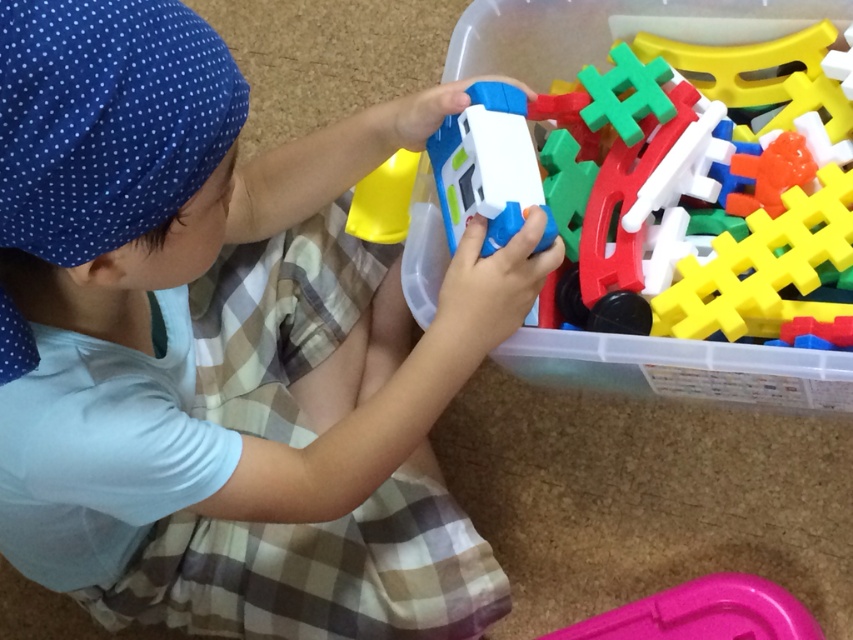
Which of these two, matte plastic toy car at center or blue plastic toy car at center, stands taller?

matte plastic toy car at center

Does matte plastic toy car at center appear on the right side of blue plastic toy car at center?

Incorrect, matte plastic toy car at center is not on the right side of blue plastic toy car at center.

The image size is (853, 640). I want to click on matte plastic toy car at center, so click(224, 348).

The height and width of the screenshot is (640, 853). Find the location of `matte plastic toy car at center`. matte plastic toy car at center is located at coordinates (224, 348).

Who is more forward, (437, 84) or (776, 621)?

Point (437, 84) is more forward.

Between matte plastic toy car at center and pink plastic tray at lower right, which one appears on the right side from the viewer's perspective?

pink plastic tray at lower right

Is point (143, 308) positioned behind point (637, 611)?

No, (143, 308) is in front of (637, 611).

Locate an element on the screen. Image resolution: width=853 pixels, height=640 pixels. matte plastic toy car at center is located at coordinates (224, 348).

Is blue plastic toy car at center positioned in front of pink plastic tray at lower right?

Result: Yes, it is.

I want to click on blue plastic toy car at center, so click(637, 147).

You are a GUI agent. You are given a task and a screenshot of the screen. Output one action in this format:
    pyautogui.click(x=<x>, y=<y>)
    Task: Click on the blue plastic toy car at center
    
    Given the screenshot: What is the action you would take?
    pyautogui.click(x=637, y=147)